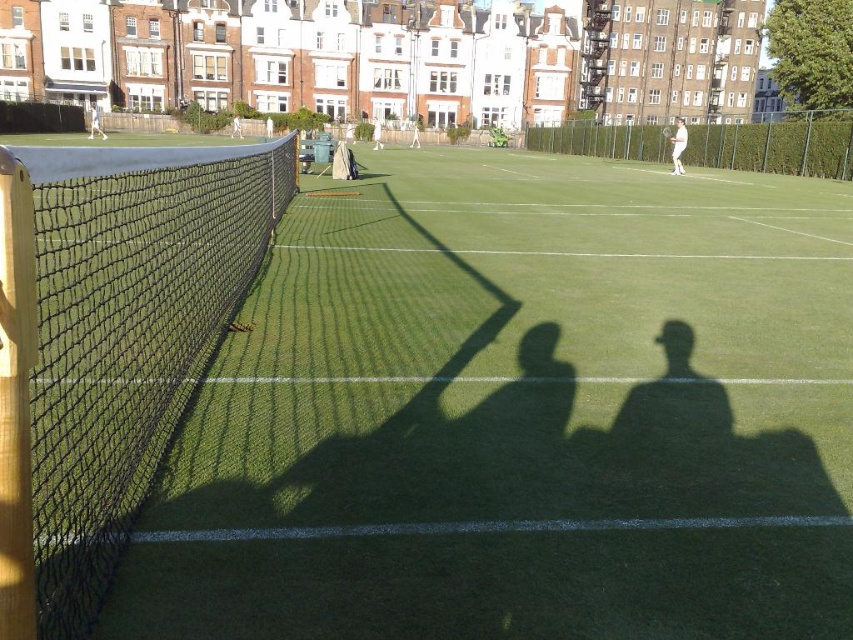
You are a tennis coach observing a player holding two rackets, a white fabric tennis racket at center and a white plastic racket at center. Which racket should the player choose if they want a thinner grip?

The player should choose the white fabric tennis racket at center because it is thinner than the white plastic racket at center.

You are a tennis coach observing a practice session on the court. You notice two rackets lying on the court at the center. The white fabric tennis racket at center and the white plastic racket at center. How far apart are these two rackets from each other?

The distance between the white fabric tennis racket at center and the white plastic racket at center is 99.87 feet.

You are a tennis player standing on the court and see the point marked at coordinates [677,145]. What object is located at that point?

The point at [677,145] marks the location of the white cotton tennis racket at right.